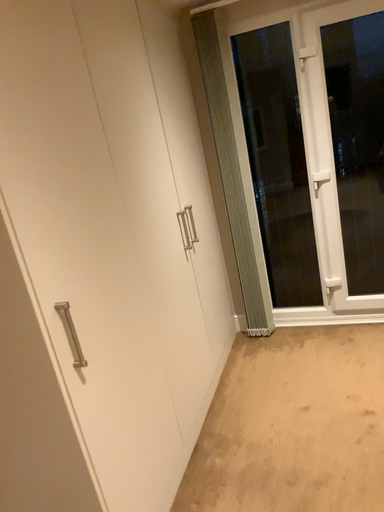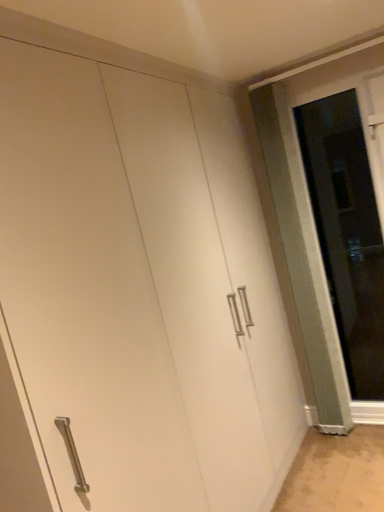
Question: Which way did the camera rotate in the video?

Choices:
 (A) rotated upward
 (B) rotated downward

Answer: (A)